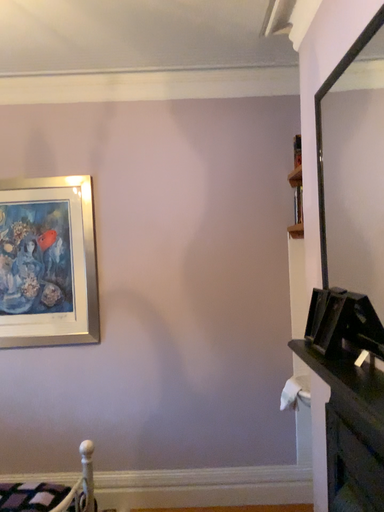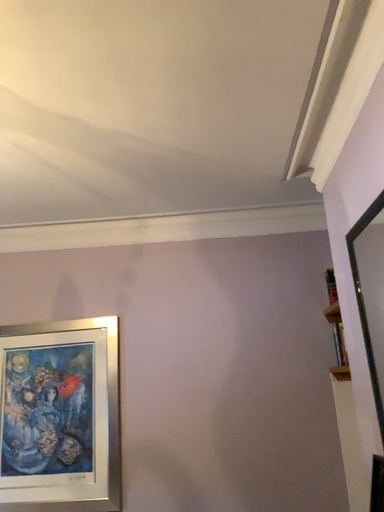
Question: Which way did the camera rotate in the video?

Choices:
 (A) rotated downward
 (B) rotated upward

Answer: (B)